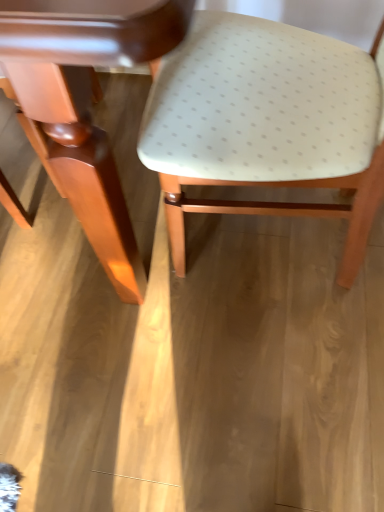
Question: Is matte white table at center spatially inside matte white plastic chair at center, or outside of it?

Choices:
 (A) inside
 (B) outside

Answer: (B)

Question: From a real-world perspective, is matte white table at center positioned above or below matte white plastic chair at center?

Choices:
 (A) below
 (B) above

Answer: (B)

Question: Visually, is matte white table at center positioned to the left or to the right of matte white plastic chair at center?

Choices:
 (A) right
 (B) left

Answer: (B)

Question: Considering their positions, is matte white plastic chair at center located in front of or behind matte white table at center?

Choices:
 (A) behind
 (B) front

Answer: (A)

Question: Choose the correct answer: Is matte white plastic chair at center inside matte white table at center or outside it?

Choices:
 (A) outside
 (B) inside

Answer: (A)

Question: In terms of width, does matte white plastic chair at center look wider or thinner when compared to matte white table at center?

Choices:
 (A) wide
 (B) thin

Answer: (B)

Question: Is point (350, 154) closer or farther from the camera than point (72, 56)?

Choices:
 (A) farther
 (B) closer

Answer: (A)